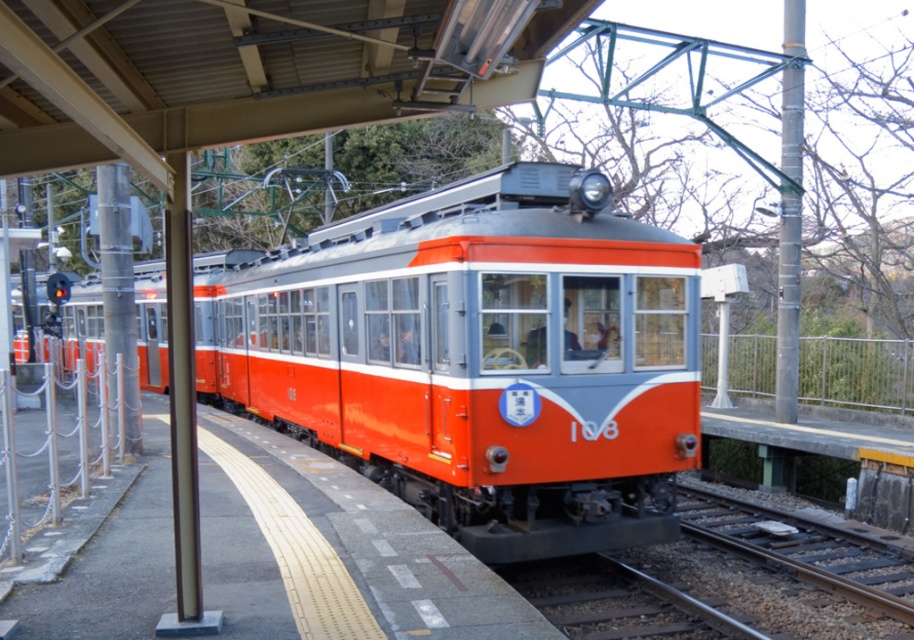
Looking at this image, you are a passenger waiting at the train station. You notice the matte orange train at center and the smooth metal track at lower center. Which object appears bigger in the image?

The matte orange train at center has a larger size compared to the smooth metal track at lower center, so the matte orange train at center appears bigger in the image.

You are a passenger standing on the platform waiting for the matte orange train at center. You notice the smooth metal track at lower center. Which object is closer to you as you face the train?

The matte orange train at center is closer to you because it is positioned in front of the smooth metal track at lower center.